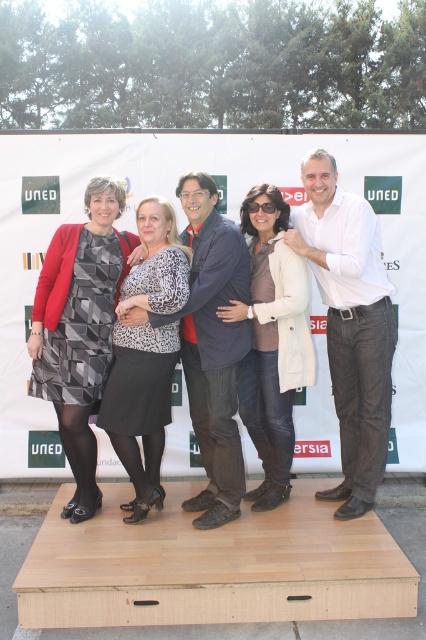
Who is shorter, white cotton shirt at center or white matte jacket at center?

With less height is white matte jacket at center.

Between white cotton shirt at center and white matte jacket at center, which one has more height?

white cotton shirt at center

Who is more forward, (x=342, y=440) or (x=261, y=241)?

Point (x=261, y=241) is more forward.

At what (x,y) coordinates should I click in order to perform the action: click on white cotton shirt at center. Please return your answer as a coordinate pair (x, y). Looking at the image, I should click on (350, 324).

Is white cotton shirt at center shorter than matte black dress at center?

In fact, white cotton shirt at center may be taller than matte black dress at center.

Can you confirm if white cotton shirt at center is bigger than matte black dress at center?

Yes.

Between point (377, 292) and point (92, 298), which one is positioned behind?

The point (92, 298) is behind.

This screenshot has width=426, height=640. In order to click on white cotton shirt at center in this screenshot , I will do `click(350, 324)`.

Is matte black dress at center positioned before white matte jacket at center?

No, matte black dress at center is further to the viewer.

Which of these two, matte black dress at center or white matte jacket at center, stands taller?

matte black dress at center

Who is more forward, (92, 497) or (294, 278)?

Positioned in front is point (294, 278).

Where is `matte black dress at center`? The width and height of the screenshot is (426, 640). matte black dress at center is located at coordinates (80, 328).